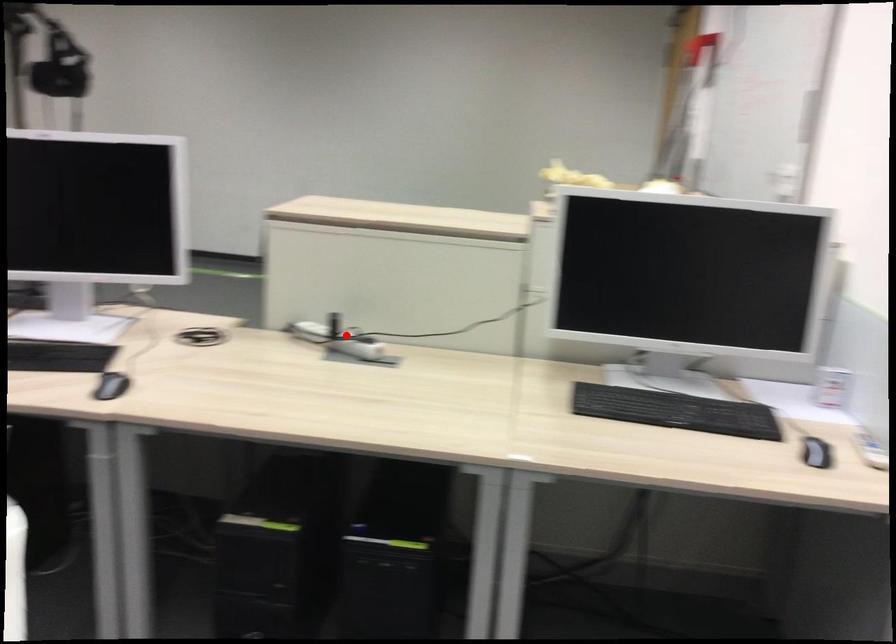
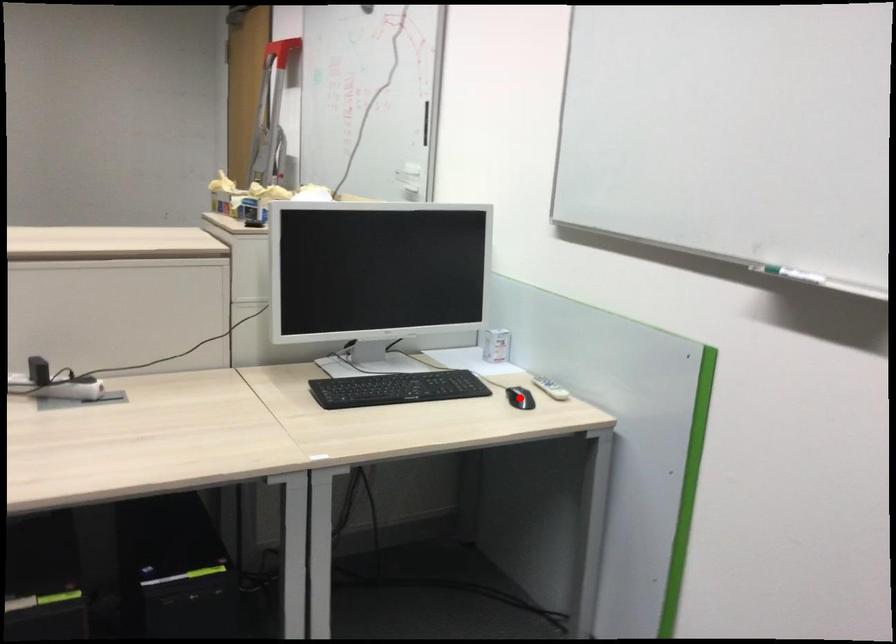
I am providing you with two images of the same scene from different viewpoints. A red point is marked on the first image and another point is marked on the second image. Is the red point in image1 aligned with the point shown in image2?

No